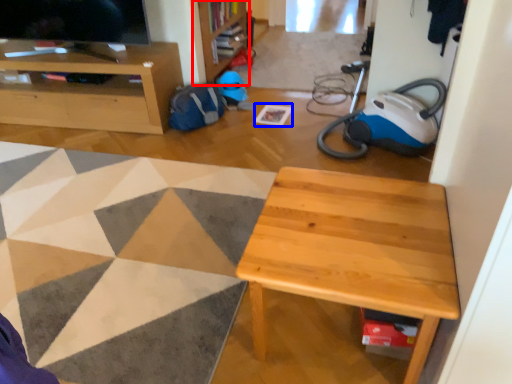
Question: Among these objects, which one is farthest to the camera, bookshelf (highlighted by a red box) or square (highlighted by a blue box)?

Choices:
 (A) bookshelf
 (B) square

Answer: (A)